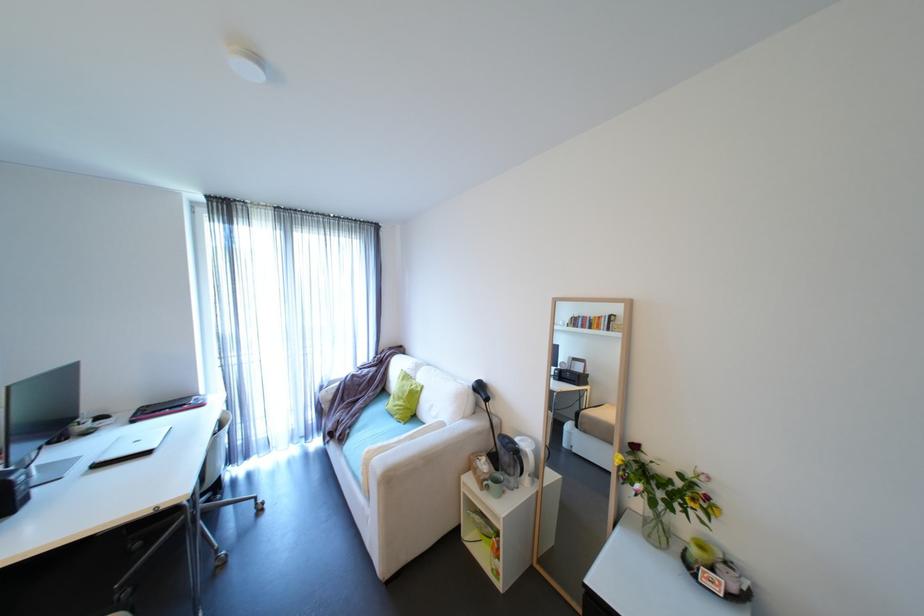
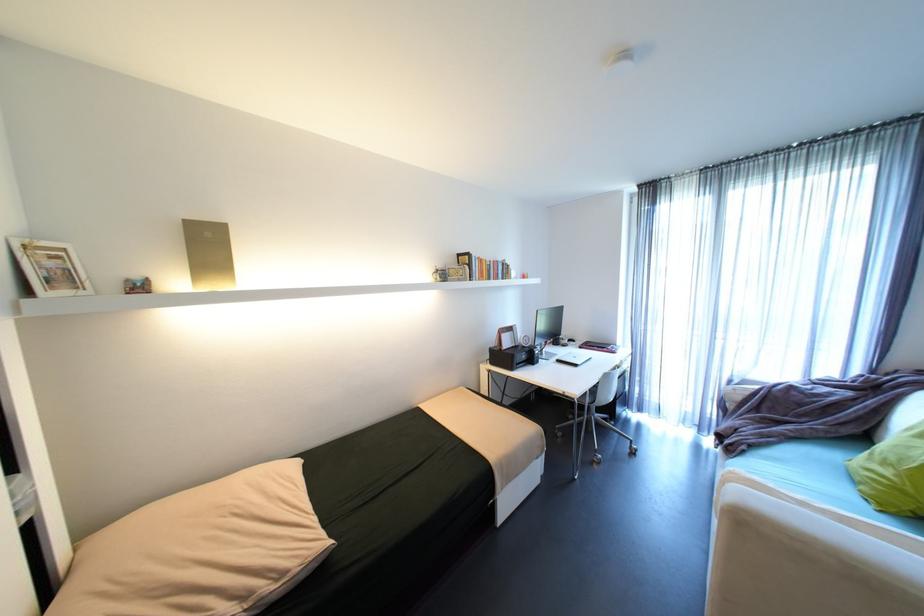
Find the pixel in the second image that matches [141,416] in the first image.

(589, 344)